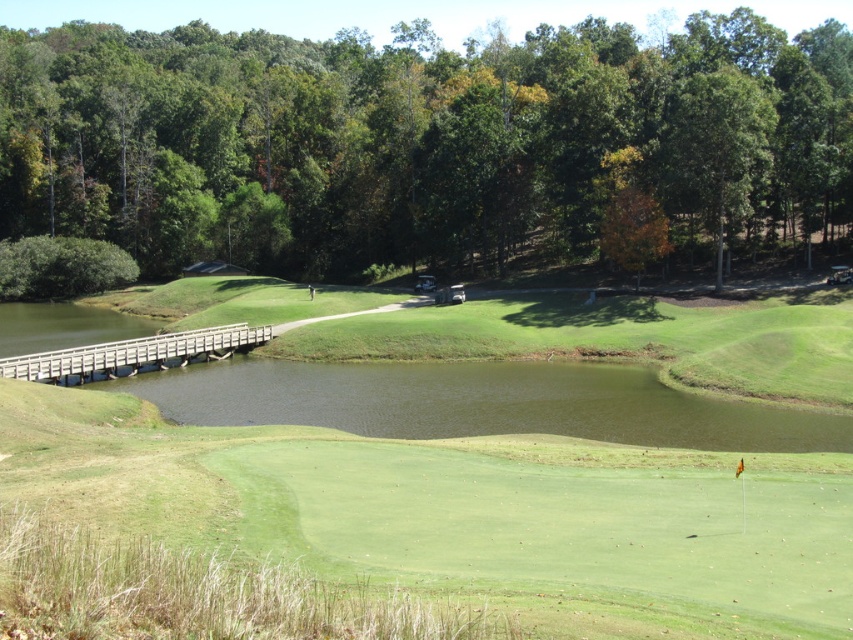
Question: Which point is closer to the camera?

Choices:
 (A) (538, 600)
 (B) (25, 372)

Answer: (A)

Question: Which object appears farthest from the camera in this image?

Choices:
 (A) green leafy trees at upper center
 (B) green grassy golf course at center
 (C) wooden bridge at lower left
 (D) orange leafy tree at upper center

Answer: (D)

Question: Observing the image, what is the correct spatial positioning of green leafy trees at upper center in reference to orange leafy tree at upper center?

Choices:
 (A) below
 (B) above

Answer: (B)

Question: Does green leafy trees at upper center appear on the left side of green grassy golf course at center?

Choices:
 (A) no
 (B) yes

Answer: (B)

Question: Is green leafy trees at upper center below green grassy golf course at center?

Choices:
 (A) no
 (B) yes

Answer: (A)

Question: Among these objects, which one is nearest to the camera?

Choices:
 (A) wooden bridge at lower left
 (B) orange leafy tree at upper center

Answer: (A)